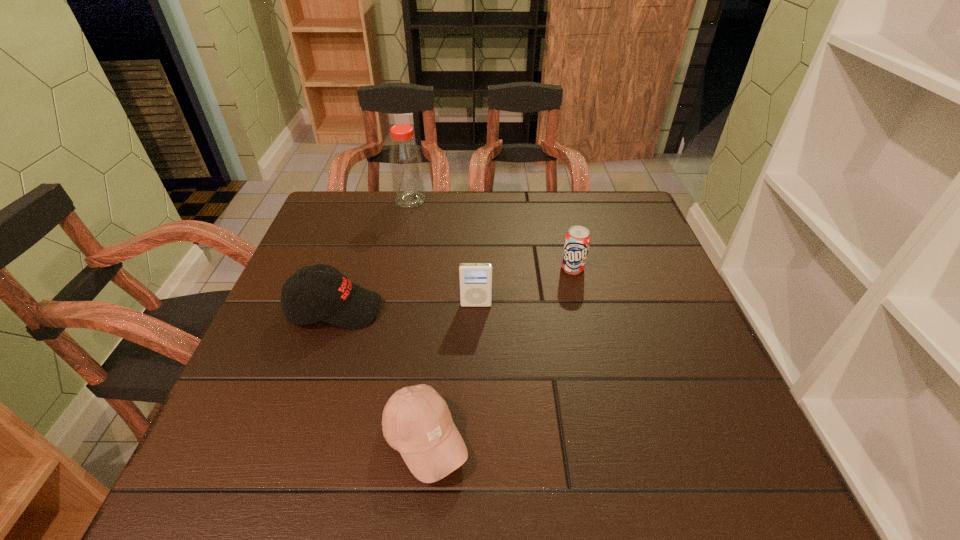
At what (x,y) coordinates should I click in order to perform the action: click on free space at the far left corner of the desktop. Please return your answer as a coordinate pair (x, y). This screenshot has height=540, width=960. Looking at the image, I should click on (348, 199).

At what (x,y) coordinates should I click in order to perform the action: click on free space at the near left corner. Please return your answer as a coordinate pair (x, y). This screenshot has width=960, height=540. Looking at the image, I should click on (230, 490).

Image resolution: width=960 pixels, height=540 pixels. I want to click on vacant region at the far right corner of the desktop, so 635,201.

What are the coordinates of `vacant area that lies between the tallest object and the fourth nearest object` in the screenshot? It's located at (492, 234).

This screenshot has width=960, height=540. What are the coordinates of `free space between the iPod and the bottle` in the screenshot? It's located at (x=444, y=252).

What are the coordinates of `free spot between the rightmost object and the taller baseball cap` in the screenshot? It's located at (454, 289).

Locate an element on the screen. This screenshot has height=540, width=960. vacant area that lies between the left baseball cap and the rightmost object is located at coordinates (454, 289).

At what (x,y) coordinates should I click in order to perform the action: click on free area in between the right baseball cap and the bottle. Please return your answer as a coordinate pair (x, y). The width and height of the screenshot is (960, 540). Looking at the image, I should click on (418, 320).

You are a GUI agent. You are given a task and a screenshot of the screen. Output one action in this format:
    pyautogui.click(x=<x>, y=<y>)
    Task: Click on the free spot between the nearer baseball cap and the farther baseball cap
    This screenshot has width=960, height=540.
    Given the screenshot: What is the action you would take?
    pyautogui.click(x=380, y=374)

You are a GUI agent. You are given a task and a screenshot of the screen. Output one action in this format:
    pyautogui.click(x=<x>, y=<y>)
    Task: Click on the vacant area that lies between the iPod and the shorter baseball cap
    
    Given the screenshot: What is the action you would take?
    pyautogui.click(x=450, y=373)